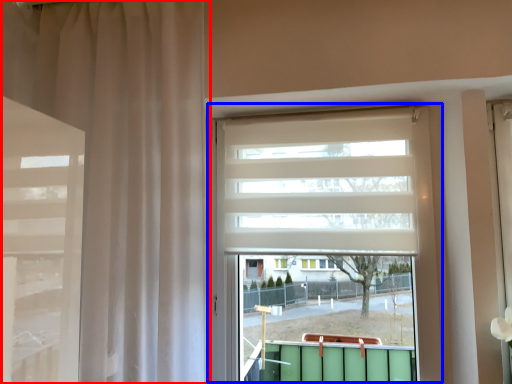
Question: Among these objects, which one is nearest to the camera, curtain (highlighted by a red box) or window (highlighted by a blue box)?

Choices:
 (A) curtain
 (B) window

Answer: (A)